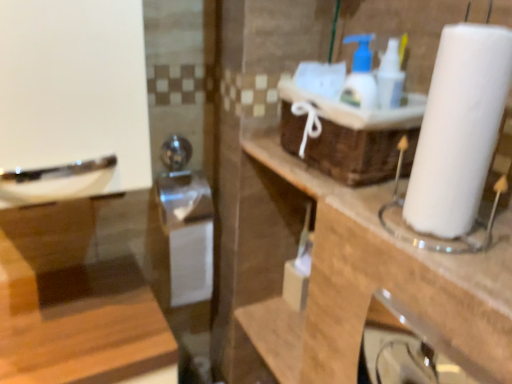
You are a GUI agent. You are given a task and a screenshot of the screen. Output one action in this format:
    pyautogui.click(x=<x>, y=<y>)
    Task: Click on the free location above white paper towel at right (from a real-world perspective)
    
    Given the screenshot: What is the action you would take?
    pyautogui.click(x=395, y=202)